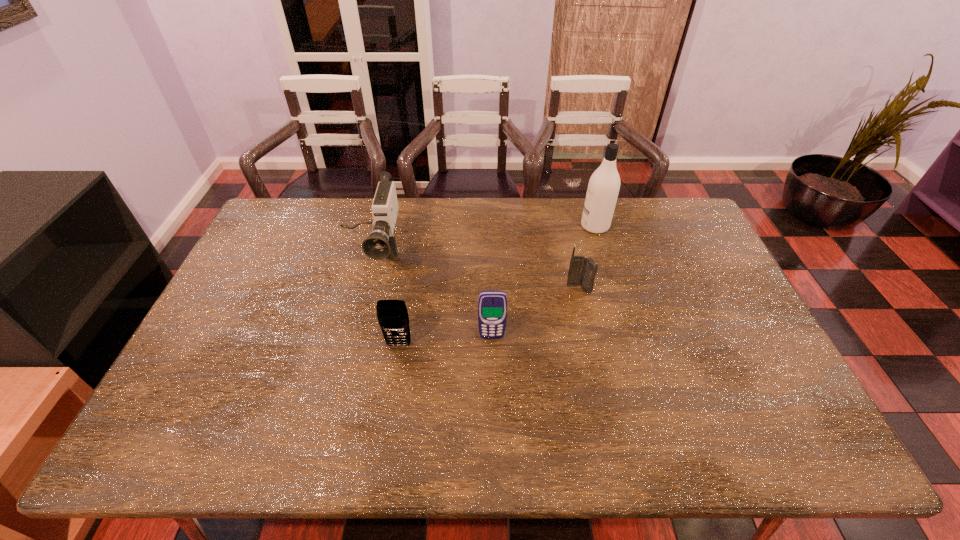
Where is `blank space at the left edge`? The width and height of the screenshot is (960, 540). blank space at the left edge is located at coordinates (214, 329).

This screenshot has height=540, width=960. What are the coordinates of `blank space at the far right corner` in the screenshot? It's located at point(660,212).

Where is `unoccupied area between the nearest object and the shampoo`? The width and height of the screenshot is (960, 540). unoccupied area between the nearest object and the shampoo is located at coordinates (496, 286).

At what (x,y) coordinates should I click in order to perform the action: click on free space between the nearest cellular telephone and the second cellular telephone from right to left. Please return your answer as a coordinate pair (x, y). This screenshot has width=960, height=540. Looking at the image, I should click on (445, 341).

The image size is (960, 540). I want to click on vacant area that lies between the shampoo and the rightmost cellular telephone, so click(587, 258).

The width and height of the screenshot is (960, 540). Find the location of `free spot between the farthest cellular telephone and the third object from left to right`. free spot between the farthest cellular telephone and the third object from left to right is located at coordinates (536, 313).

Identify the location of blank region between the camcorder and the tallest object. (483, 241).

The image size is (960, 540). I want to click on free space between the shampoo and the nearest cellular telephone, so click(496, 286).

Where is `free area in between the leftmost cellular telephone and the shampoo`? free area in between the leftmost cellular telephone and the shampoo is located at coordinates (496, 286).

The width and height of the screenshot is (960, 540). What are the coordinates of `vacant area that lies between the second farthest cellular telephone and the tallest object` in the screenshot? It's located at coord(543,281).